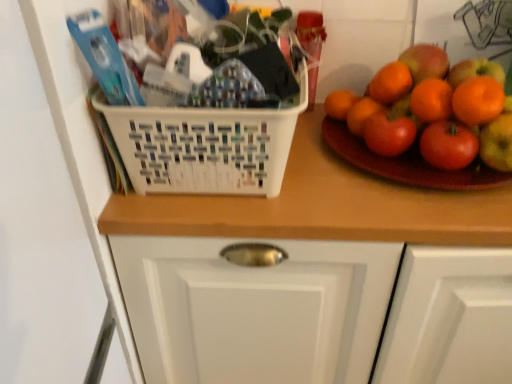
Question: In terms of width, does white plastic basket at center look wider or thinner when compared to wooden counter at center?

Choices:
 (A) thin
 (B) wide

Answer: (A)

Question: Is white plastic basket at center inside or outside of wooden counter at center?

Choices:
 (A) outside
 (B) inside

Answer: (A)

Question: Which object is the closest to the wooden counter at center?

Choices:
 (A) white plastic basket at center
 (B) glossy wooden plate at right

Answer: (A)

Question: Which object is positioned closest to the wooden counter at center?

Choices:
 (A) white plastic basket at center
 (B) glossy wooden plate at right

Answer: (A)